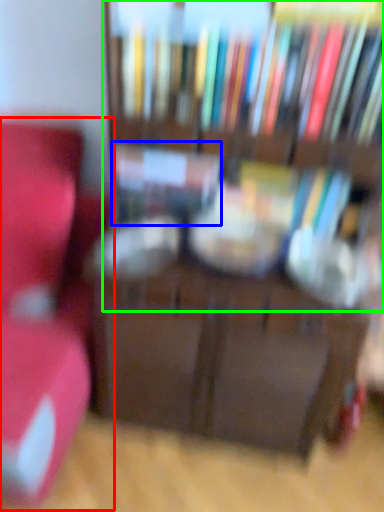
Question: Based on their relative distances, which object is farther from furniture (highlighted by a red box)? Choose from book (highlighted by a blue box) and bookcase (highlighted by a green box).

Choices:
 (A) book
 (B) bookcase

Answer: (B)